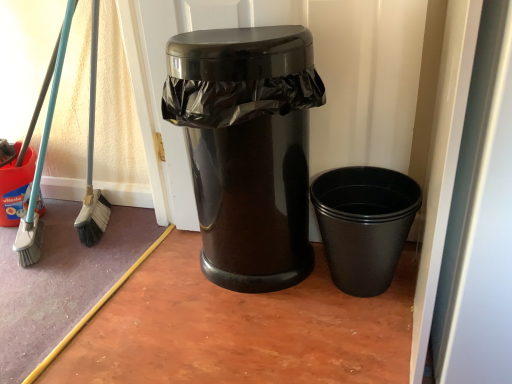
Question: Is glossy black trash can at center, the 1th waste container in the left-to-right sequence, in front of black plastic cup at lower right, positioned as the 1th waste container in right-to-left order?

Choices:
 (A) yes
 (B) no

Answer: (A)

Question: Is glossy black trash can at center, arranged as the second waste container when viewed from the right, placed right next to black plastic cup at lower right, positioned as the 1th waste container in right-to-left order?

Choices:
 (A) yes
 (B) no

Answer: (B)

Question: Can you confirm if glossy black trash can at center, arranged as the second waste container when viewed from the right, is shorter than black plastic cup at lower right, acting as the 2th waste container starting from the left?

Choices:
 (A) no
 (B) yes

Answer: (A)

Question: From the image's perspective, does glossy black trash can at center, the 1th waste container in the left-to-right sequence, appear lower than black plastic cup at lower right, acting as the 2th waste container starting from the left?

Choices:
 (A) yes
 (B) no

Answer: (B)

Question: Can you confirm if glossy black trash can at center, the 1th waste container in the left-to-right sequence, is bigger than black plastic cup at lower right, acting as the 2th waste container starting from the left?

Choices:
 (A) yes
 (B) no

Answer: (A)

Question: Can black plastic cup at lower right, positioned as the 1th waste container in right-to-left order, be found inside glossy black trash can at center, arranged as the second waste container when viewed from the right?

Choices:
 (A) no
 (B) yes

Answer: (A)

Question: Is glossy black trash can at center, arranged as the second waste container when viewed from the right, outside of glossy plastic trash can at center?

Choices:
 (A) yes
 (B) no

Answer: (A)

Question: Can you confirm if glossy black trash can at center, arranged as the second waste container when viewed from the right, is smaller than glossy plastic trash can at center?

Choices:
 (A) yes
 (B) no

Answer: (B)

Question: Is the position of glossy black trash can at center, arranged as the second waste container when viewed from the right, more distant than that of glossy plastic trash can at center?

Choices:
 (A) no
 (B) yes

Answer: (A)

Question: Can you see glossy black trash can at center, arranged as the second waste container when viewed from the right, touching glossy plastic trash can at center?

Choices:
 (A) no
 (B) yes

Answer: (A)

Question: Does glossy black trash can at center, the 1th waste container in the left-to-right sequence, appear on the left side of glossy plastic trash can at center?

Choices:
 (A) yes
 (B) no

Answer: (A)

Question: From the image's perspective, is glossy black trash can at center, arranged as the second waste container when viewed from the right, over glossy plastic trash can at center?

Choices:
 (A) yes
 (B) no

Answer: (B)

Question: Considering the relative positions of black plastic cup at lower right, positioned as the 1th waste container in right-to-left order, and glossy black trash can at center, arranged as the second waste container when viewed from the right, in the image provided, is black plastic cup at lower right, positioned as the 1th waste container in right-to-left order, in front of glossy black trash can at center, arranged as the second waste container when viewed from the right,?

Choices:
 (A) yes
 (B) no

Answer: (B)